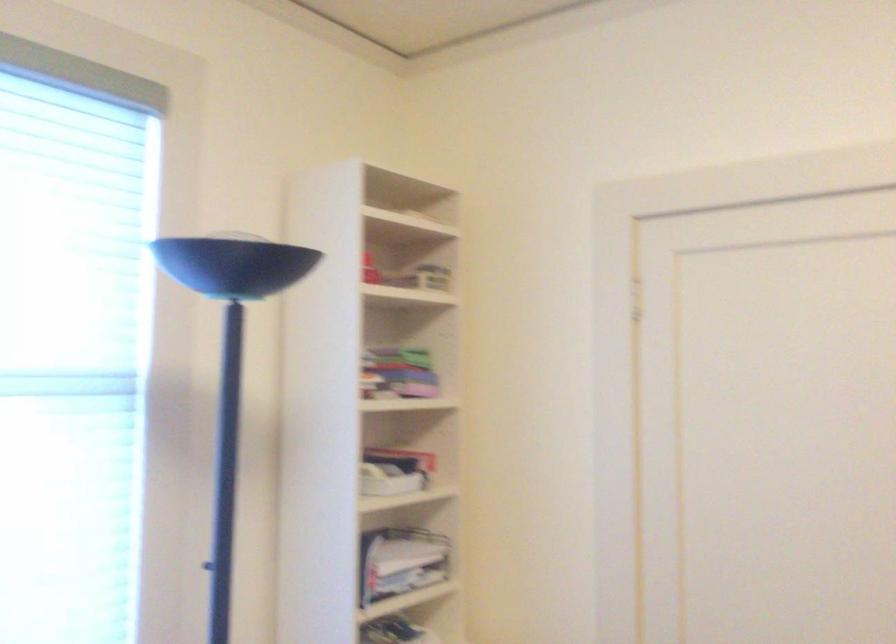
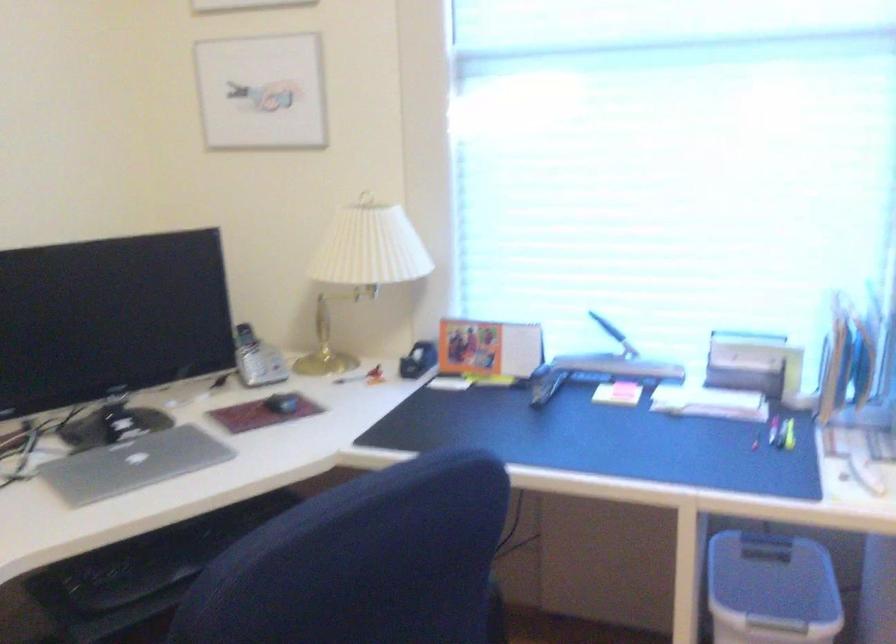
Question: How did the camera likely rotate?

Choices:
 (A) Left
 (B) Right
 (C) Up
 (D) Down

Answer: (A)